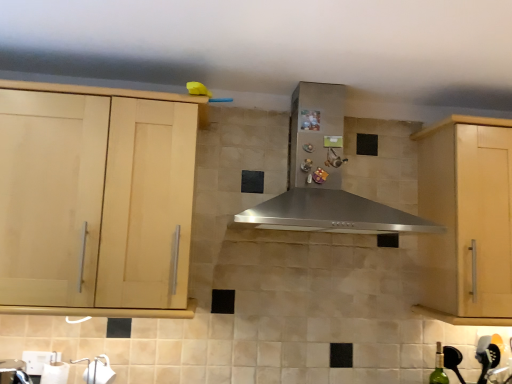
Question: Should I look upward or downward to see green glass bottle at lower right?

Choices:
 (A) up
 (B) down

Answer: (B)

Question: Does light wood cabinet at left, arranged as the first cabinetry when viewed from the left, appear on the left side of light wood cabinet at right, which is counted as the 2th cabinetry, starting from the left?

Choices:
 (A) no
 (B) yes

Answer: (B)

Question: Considering the relative positions of light wood cabinet at left, arranged as the first cabinetry when viewed from the left, and light wood cabinet at right, which is counted as the 2th cabinetry, starting from the left, in the image provided, is light wood cabinet at left, arranged as the first cabinetry when viewed from the left, in front of light wood cabinet at right, which is counted as the 2th cabinetry, starting from the left,?

Choices:
 (A) no
 (B) yes

Answer: (B)

Question: Considering the relative sizes of light wood cabinet at left, which is counted as the 2th cabinetry, starting from the right, and light wood cabinet at right, which is counted as the 2th cabinetry, starting from the left, in the image provided, is light wood cabinet at left, which is counted as the 2th cabinetry, starting from the right, smaller than light wood cabinet at right, which is counted as the 2th cabinetry, starting from the left,?

Choices:
 (A) yes
 (B) no

Answer: (B)

Question: From the image's perspective, is light wood cabinet at left, arranged as the first cabinetry when viewed from the left, over light wood cabinet at right, which is counted as the 2th cabinetry, starting from the left?

Choices:
 (A) no
 (B) yes

Answer: (B)

Question: Can you confirm if light wood cabinet at left, arranged as the first cabinetry when viewed from the left, is taller than light wood cabinet at right, which is counted as the 2th cabinetry, starting from the left?

Choices:
 (A) yes
 (B) no

Answer: (B)

Question: Is light wood cabinet at left, arranged as the first cabinetry when viewed from the left, oriented away from light wood cabinet at right, which is counted as the 2th cabinetry, starting from the left?

Choices:
 (A) yes
 (B) no

Answer: (B)

Question: From the image's perspective, is light wood cabinet at right, which is counted as the 2th cabinetry, starting from the left, beneath stainless steel range hood at center?

Choices:
 (A) yes
 (B) no

Answer: (A)

Question: From a real-world perspective, is light wood cabinet at right, which is counted as the 2th cabinetry, starting from the left, on stainless steel range hood at center?

Choices:
 (A) no
 (B) yes

Answer: (A)

Question: Is light wood cabinet at right, which is counted as the 2th cabinetry, starting from the left, outside of stainless steel range hood at center?

Choices:
 (A) yes
 (B) no

Answer: (A)

Question: Is light wood cabinet at right, which is counted as the 2th cabinetry, starting from the left, turned away from stainless steel range hood at center?

Choices:
 (A) yes
 (B) no

Answer: (B)

Question: Is the position of light wood cabinet at right, which is counted as the 2th cabinetry, starting from the left, more distant than that of stainless steel range hood at center?

Choices:
 (A) no
 (B) yes

Answer: (B)

Question: Is light wood cabinet at right, which is counted as the 2th cabinetry, starting from the left, shorter than stainless steel range hood at center?

Choices:
 (A) yes
 (B) no

Answer: (B)

Question: From a real-world perspective, is light wood cabinet at left, arranged as the first cabinetry when viewed from the left, located higher than green glass bottle at lower right?

Choices:
 (A) no
 (B) yes

Answer: (B)